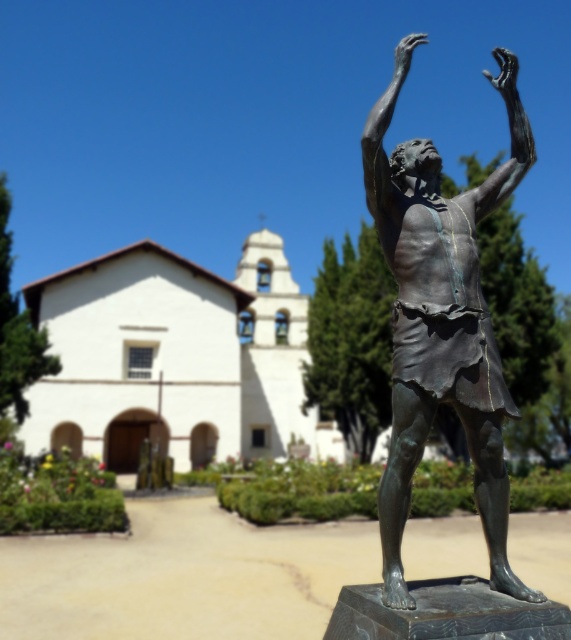
Is point (115, 372) in front of point (368, 205)?

No.

Is white stucco church at center to the left of bronze statue at center from the viewer's perspective?

Correct, you'll find white stucco church at center to the left of bronze statue at center.

Is point (182, 401) behind point (451, 253)?

Yes, point (182, 401) is farther from viewer.

This screenshot has width=571, height=640. I want to click on white stucco church at center, so click(175, 358).